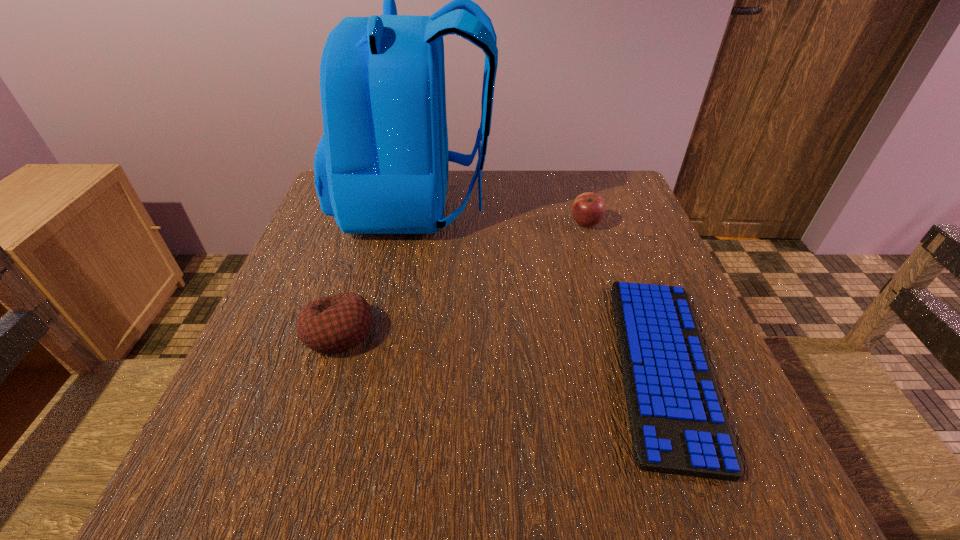
You are a GUI agent. You are given a task and a screenshot of the screen. Output one action in this format:
    pyautogui.click(x=<x>, y=<y>)
    Task: Click on the vacant space that is in between the backpack and the apple
    Image resolution: width=960 pixels, height=540 pixels.
    Given the screenshot: What is the action you would take?
    pyautogui.click(x=501, y=214)

Locate an element on the screen. free space between the apple and the beanbag is located at coordinates (463, 278).

Identify which object is the second nearest to the tallest object. Please provide its 2D coordinates. Your answer should be formatted as a tuple, i.e. [(x, y)], where the tuple contains the x and y coordinates of a point satisfying the conditions above.

[(339, 322)]

I want to click on object that stands as the third closest to the second shortest object, so pyautogui.click(x=588, y=209).

Locate an element on the screen. The width and height of the screenshot is (960, 540). vacant area that satisfies the following two spatial constraints: 1. on the front side of the second shortest object; 2. on the right side of the computer keyboard is located at coordinates (327, 366).

The height and width of the screenshot is (540, 960). In order to click on free location that satisfies the following two spatial constraints: 1. on the back of the computer keyboard; 2. on the left side of the backpack in this screenshot , I will do (x=386, y=366).

Locate an element on the screen. free space that satisfies the following two spatial constraints: 1. on the back of the tallest object; 2. on the back side of the apple is located at coordinates (414, 224).

Where is `blank area in the image that satisfies the following two spatial constraints: 1. on the back side of the apple; 2. on the right side of the beanbag`? Image resolution: width=960 pixels, height=540 pixels. blank area in the image that satisfies the following two spatial constraints: 1. on the back side of the apple; 2. on the right side of the beanbag is located at coordinates (372, 224).

This screenshot has height=540, width=960. I want to click on free space that satisfies the following two spatial constraints: 1. on the back of the tallest object; 2. on the left side of the computer keyboard, so click(386, 366).

In order to click on vacant space that satisfies the following two spatial constraints: 1. on the front side of the third tallest object; 2. on the right side of the computer keyboard in this screenshot , I will do `click(327, 366)`.